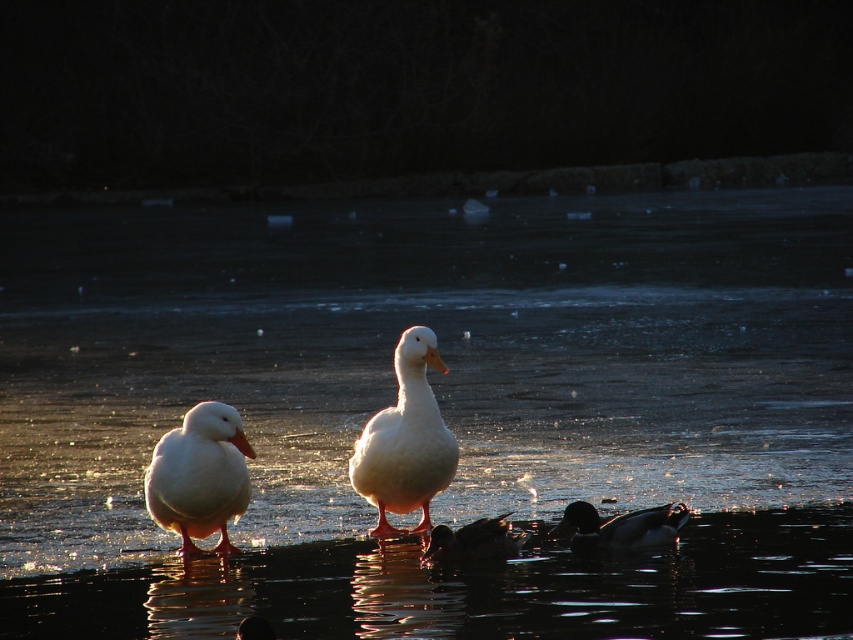
Question: Which point is closer to the camera taking this photo?

Choices:
 (A) (827, 556)
 (B) (192, 492)

Answer: (B)

Question: Can you confirm if translucent ice at center is wider than dark brown glossy duck at lower center?

Choices:
 (A) yes
 (B) no

Answer: (A)

Question: Does translucent ice at center appear on the right side of transparent ice at center?

Choices:
 (A) yes
 (B) no

Answer: (B)

Question: Based on their relative distances, which object is farther from the white matte duck at left?

Choices:
 (A) white matte duck at center
 (B) transparent ice at center
 (C) dark brown glossy duck at lower center

Answer: (C)

Question: Can you confirm if white matte duck at center is thinner than white matte duck at left?

Choices:
 (A) no
 (B) yes

Answer: (B)

Question: Which of the following is the closest to the observer?

Choices:
 (A) (454, 554)
 (B) (654, 400)
 (C) (169, 627)
 (D) (186, 449)

Answer: (C)